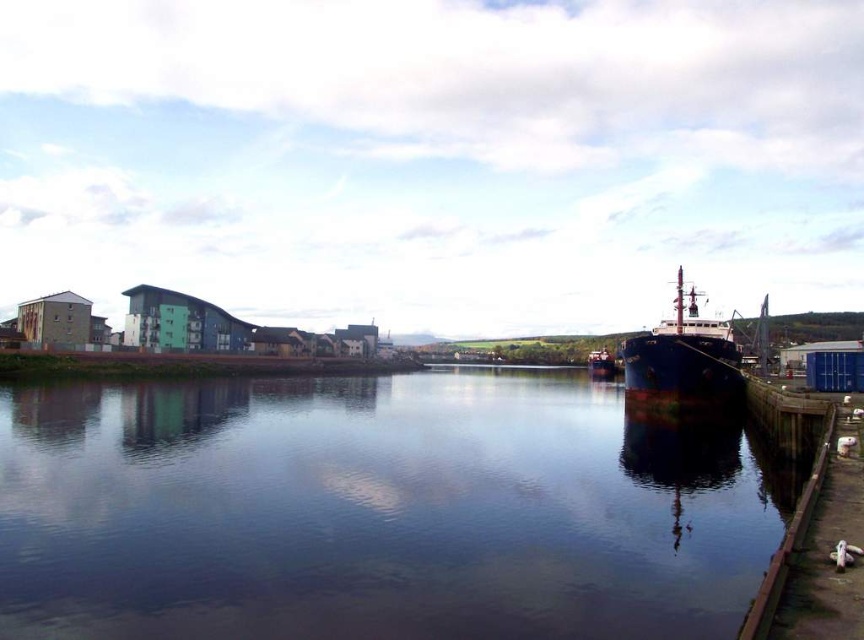
Question: Can you confirm if smooth water at center is smaller than blue metallic ship at right?

Choices:
 (A) yes
 (B) no

Answer: (B)

Question: Which point is farther to the camera?

Choices:
 (A) (612, 371)
 (B) (202, 433)

Answer: (A)

Question: Does blue metallic ship at right have a smaller size compared to blue metallic ship at center?

Choices:
 (A) yes
 (B) no

Answer: (A)

Question: Which object appears farthest from the camera in this image?

Choices:
 (A) blue metallic ship at right
 (B) blue metallic ship at center
 (C) smooth water at center

Answer: (B)

Question: In this image, where is smooth water at center located relative to blue metallic ship at right?

Choices:
 (A) left
 (B) right

Answer: (A)

Question: Which point is farther from the camera taking this photo?

Choices:
 (A) (607, 364)
 (B) (291, 460)
 (C) (674, 392)

Answer: (A)